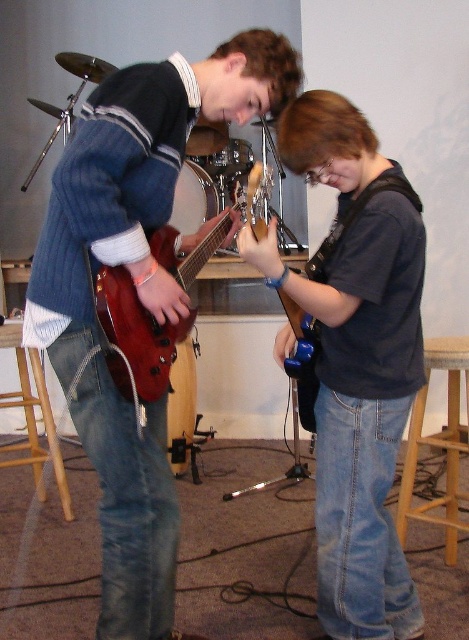
Question: Which of these objects is positioned closest to the blue glossy guitar at center?

Choices:
 (A) wooden stool at lower right
 (B) matte black guitar at center
 (C) glossy wood guitar at center

Answer: (B)

Question: Does glossy wood guitar at center appear on the left side of glossy plastic guitar at center?

Choices:
 (A) no
 (B) yes

Answer: (B)

Question: Does blue glossy guitar at center lie in front of glossy plastic guitar at center?

Choices:
 (A) yes
 (B) no

Answer: (A)

Question: Which is farther from the beech wood stool at lower left?

Choices:
 (A) wooden stool at lower right
 (B) matte black guitar at center
 (C) glossy wood guitar at center
 (D) glossy plastic guitar at center

Answer: (A)

Question: Among these points, which one is nearest to the camera?

Choices:
 (A) (454, 525)
 (B) (171, 284)
 (C) (35, 460)
 (D) (327, 458)

Answer: (B)

Question: Is blue glossy guitar at center to the right of glossy plastic guitar at center from the viewer's perspective?

Choices:
 (A) no
 (B) yes

Answer: (B)